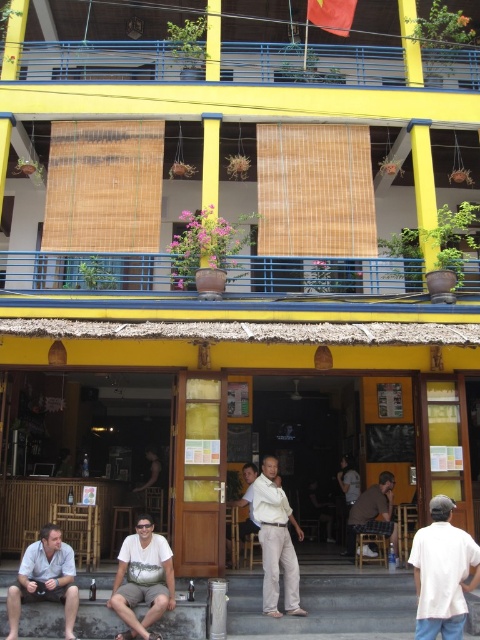
Question: Which of the following is the farthest from the observer?

Choices:
 (A) (331, 632)
 (B) (351, 520)
 (C) (153, 524)
 (D) (443, 624)

Answer: (B)

Question: Does matte white shirt at lower left appear on the right side of light brown wooden chair at center?

Choices:
 (A) no
 (B) yes

Answer: (A)

Question: Does red fabric flag at upper center have a lesser width compared to dark brown leather pants at center?

Choices:
 (A) no
 (B) yes

Answer: (A)

Question: Can you confirm if white matte shirt at center is positioned to the right of matte white shirt at lower left?

Choices:
 (A) yes
 (B) no

Answer: (A)

Question: Estimate the real-world distances between objects in this image. Which object is closer to the brown fabric shirt at lower center?

Choices:
 (A) white matte shirt at center
 (B) red fabric flag at upper center
 (C) white cotton shirt at lower center

Answer: (A)

Question: Among these points, which one is farthest from the camera?

Choices:
 (A) (158, 547)
 (B) (357, 486)
 (C) (242, 465)
 (D) (387, 525)

Answer: (B)